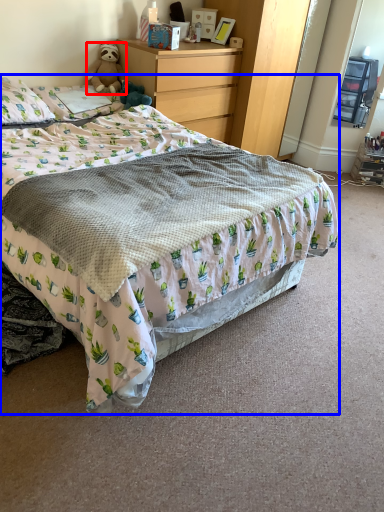
Question: Which point is closer to the camera, teddy bear (highlighted by a red box) or bed (highlighted by a blue box)?

Choices:
 (A) teddy bear
 (B) bed

Answer: (B)